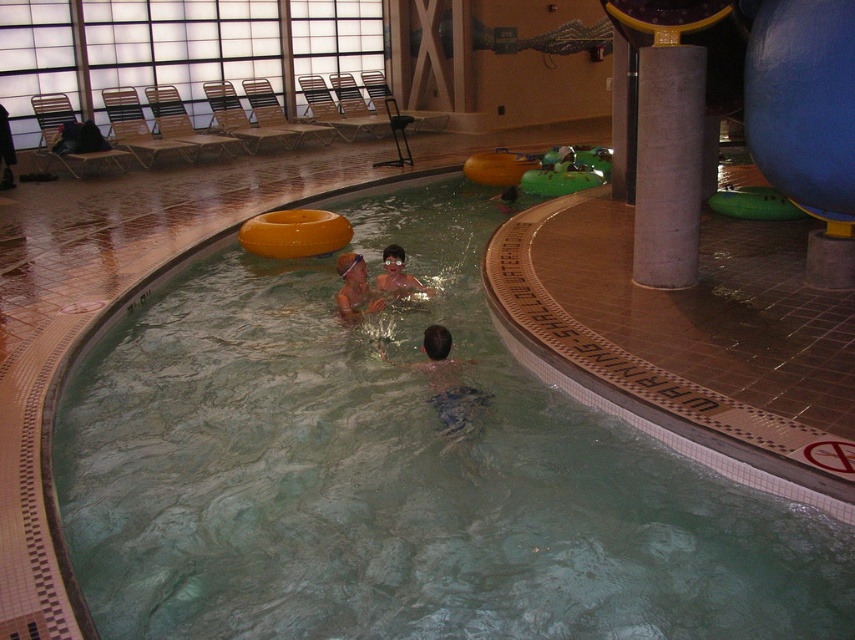
Consider the image. You are a lifeguard at the pool and need to ensure safety. Which object, the matte skin at center or the matte orange swim ring at upper center, takes up more space in the water?

The matte orange swim ring at upper center takes up more space in the water because the matte skin at center occupies less space than the matte orange swim ring at upper center.

You are a lifeguard observing the indoor pool area. You notice the green rubber at center and the matte skin at center. Which object is closer to you, the lifeguard?

The green rubber at center is closer to you because it is in front of the matte skin at center.